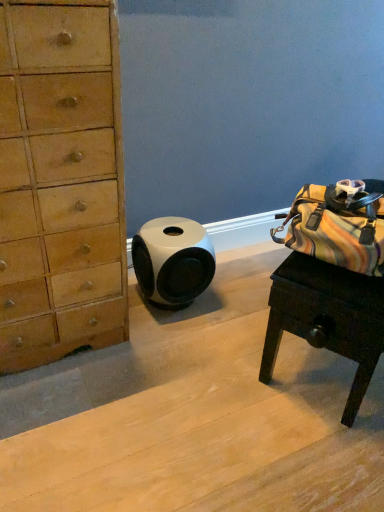
Where is `vacant area that lies to the right of white glossy speaker at center`? This screenshot has height=512, width=384. vacant area that lies to the right of white glossy speaker at center is located at coordinates click(231, 305).